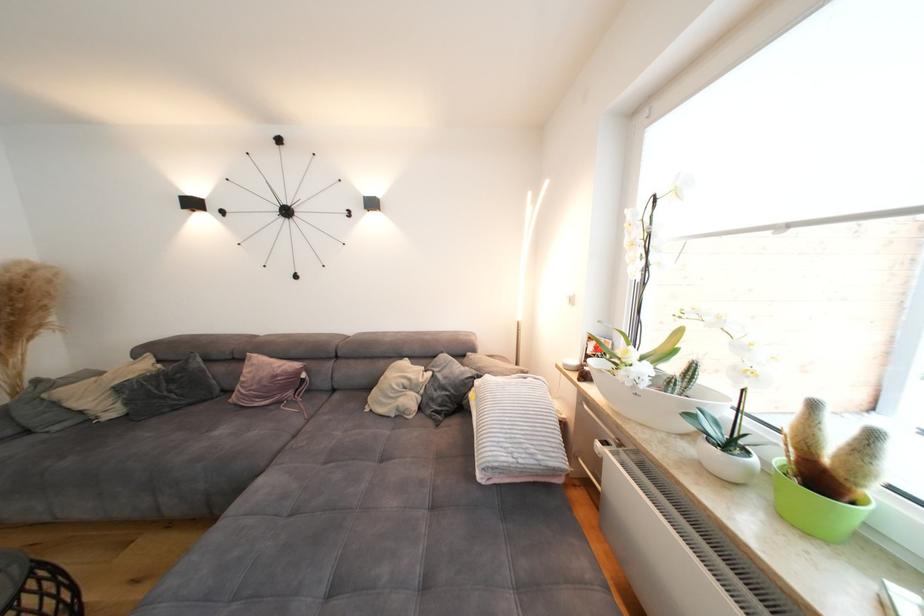
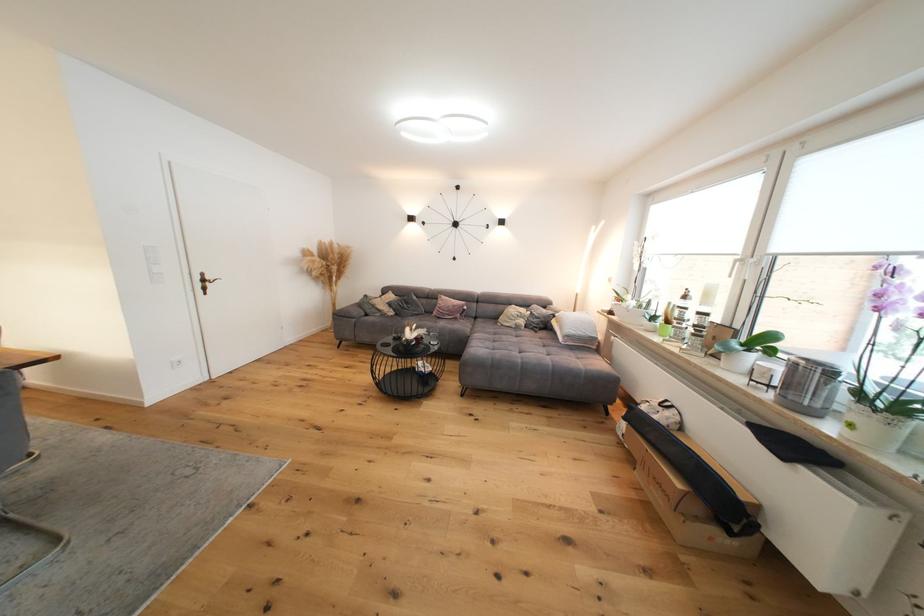
Locate, in the second image, the point that corresponds to point (418, 402) in the first image.

(529, 323)